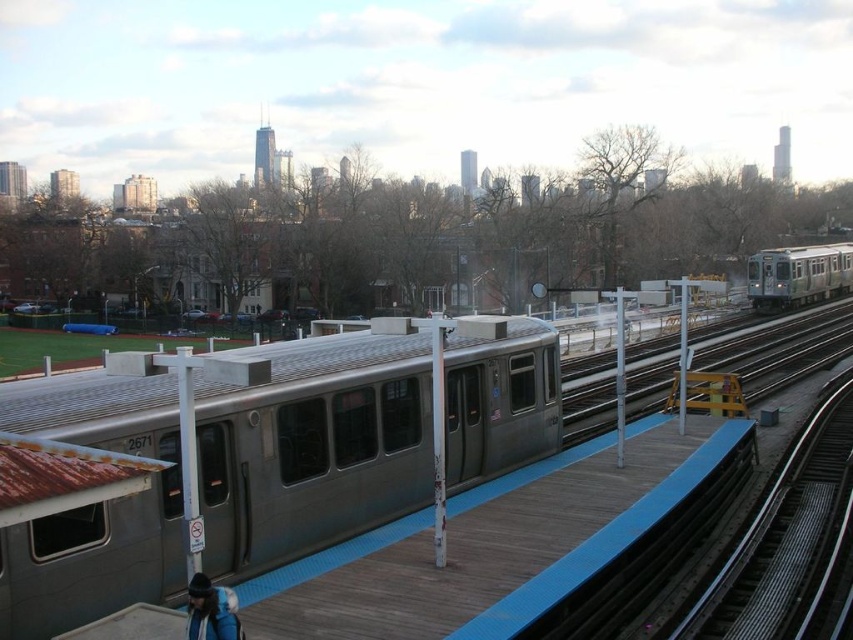
In the scene shown: Is silver metallic train at center bigger than silver metallic train at right?

No, silver metallic train at center is not bigger than silver metallic train at right.

Which of these two, silver metallic train at center or silver metallic train at right, stands taller?

silver metallic train at right

Locate an element on the screen. This screenshot has height=640, width=853. silver metallic train at center is located at coordinates (312, 448).

The width and height of the screenshot is (853, 640). I want to click on silver metallic train at center, so click(x=312, y=448).

Does smooth steel tracks at right have a larger size compared to silver metallic train at right?

No.

Which is in front, point (780, 486) or point (798, 282)?

Point (780, 486) is more forward.

Locate an element on the screen. smooth steel tracks at right is located at coordinates (791, 544).

Is silver metallic train at center thinner than smooth steel tracks at right?

Incorrect, silver metallic train at center's width is not less than smooth steel tracks at right's.

Is silver metallic train at center above smooth steel tracks at right?

Correct, silver metallic train at center is located above smooth steel tracks at right.

What do you see at coordinates (312, 448) in the screenshot?
I see `silver metallic train at center` at bounding box center [312, 448].

This screenshot has width=853, height=640. What are the coordinates of `silver metallic train at center` in the screenshot? It's located at (312, 448).